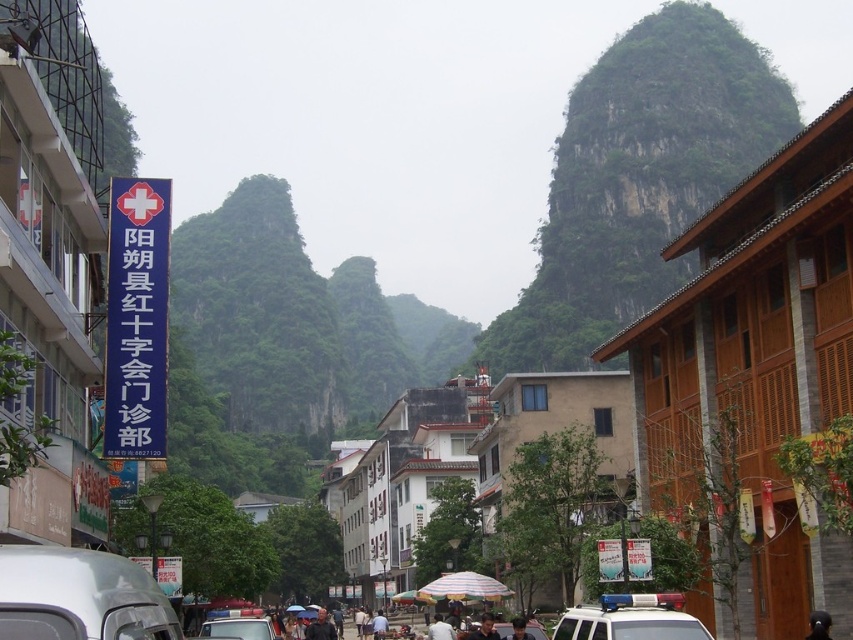
You are a photographer trying to capture a portrait of a person standing in the center of the street. The person has dark brown hair at center and is wearing a dark brown leather jacket at center. You want to ensure that both the hair and the jacket are clearly visible in your photo. Based on their sizes, which one should you focus on to ensure clarity?

The dark brown hair at center is thinner than the dark brown leather jacket at center, so focusing on the jacket would be better for clarity since it has a larger surface area.

You are a pedestrian standing on the street and see a white plastic car at lower center and a dark gray shirt at center. Which object is positioned higher from the ground?

The white plastic car at lower center is located above the dark gray shirt at center, so it is positioned higher from the ground.